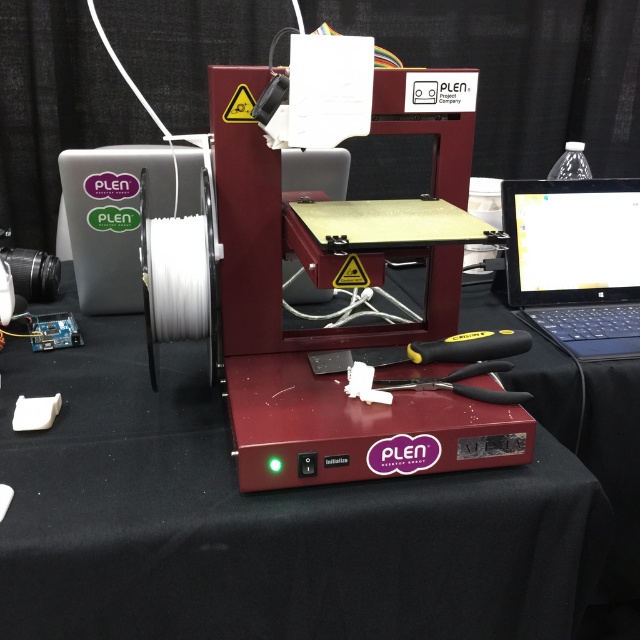
Question: Does matte red printer at center have a larger size compared to yellow rubber handle at center?

Choices:
 (A) yes
 (B) no

Answer: (A)

Question: Which object is positioned farthest from the yellow rubber handle at center?

Choices:
 (A) black plastic pliers at center
 (B) matte red printer at center

Answer: (B)

Question: Does matte red printer at center have a lesser width compared to black plastic pliers at center?

Choices:
 (A) no
 (B) yes

Answer: (A)

Question: Which point is farther to the camera?

Choices:
 (A) yellow rubber handle at center
 (B) matte red printer at center
 (C) black plastic laptop at upper right
 (D) black plastic pliers at center

Answer: (C)

Question: Is black plastic laptop at upper right to the right of black plastic pliers at center from the viewer's perspective?

Choices:
 (A) no
 (B) yes

Answer: (B)

Question: Which object is positioned closest to the black plastic pliers at center?

Choices:
 (A) matte red printer at center
 (B) black plastic laptop at upper right

Answer: (A)